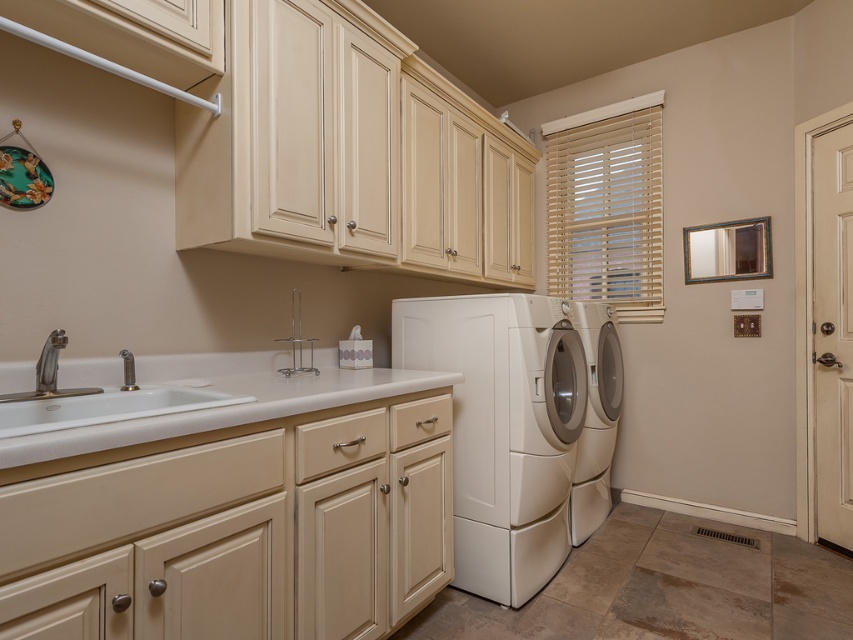
Question: Is white glossy sink at lower left smaller than white glossy washing machine at right?

Choices:
 (A) yes
 (B) no

Answer: (A)

Question: In this image, where is white glossy sink at lower left located relative to white glossy washing machine at right?

Choices:
 (A) above
 (B) below

Answer: (A)

Question: Which is farther from the white laminate countertop at lower left?

Choices:
 (A) white laminate counter at lower left
 (B) white glossy washing machine at right
 (C) white glossy sink at lower left
 (D) silver metallic faucet at sink left

Answer: (B)

Question: Based on their relative distances, which object is farther from the white glossy washing machine at center?

Choices:
 (A) white laminate countertop at lower left
 (B) white laminate counter at lower left
 (C) white glossy sink at lower left

Answer: (C)

Question: Does white glossy washing machine at right have a lesser width compared to silver metallic faucet at sink left?

Choices:
 (A) yes
 (B) no

Answer: (B)

Question: Which point is closer to the camera taking this photo?

Choices:
 (A) (592, 330)
 (B) (454, 538)
 (C) (135, 416)
 (D) (35, 385)

Answer: (C)